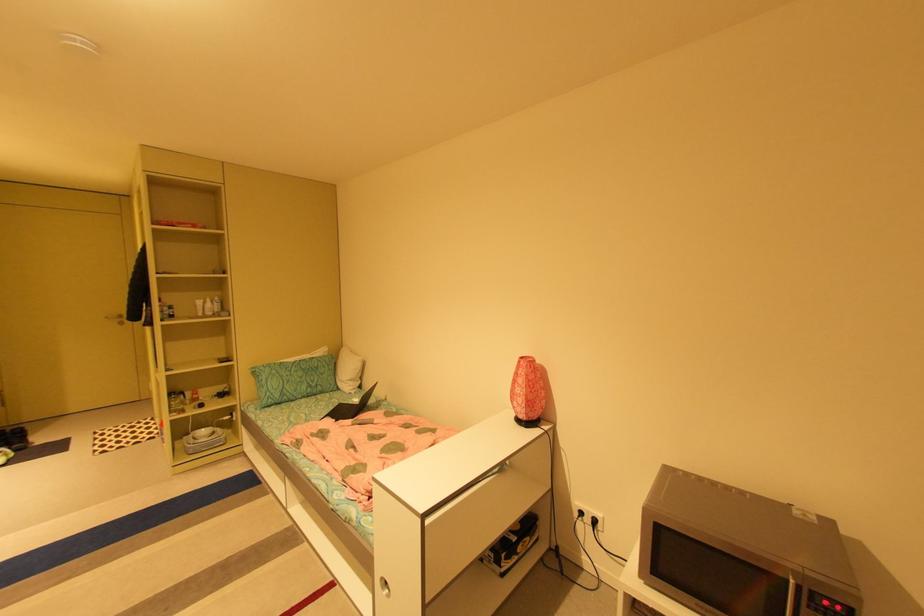
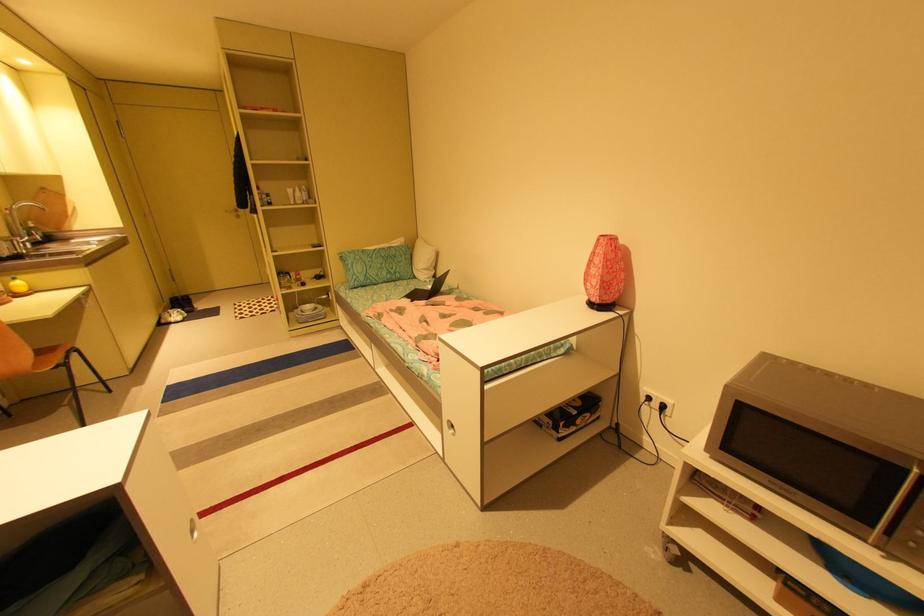
Question: The images are taken continuously from a first-person perspective. In which direction is your viewpoint rotating?

Choices:
 (A) Left
 (B) Right
 (C) Up
 (D) Down

Answer: (D)